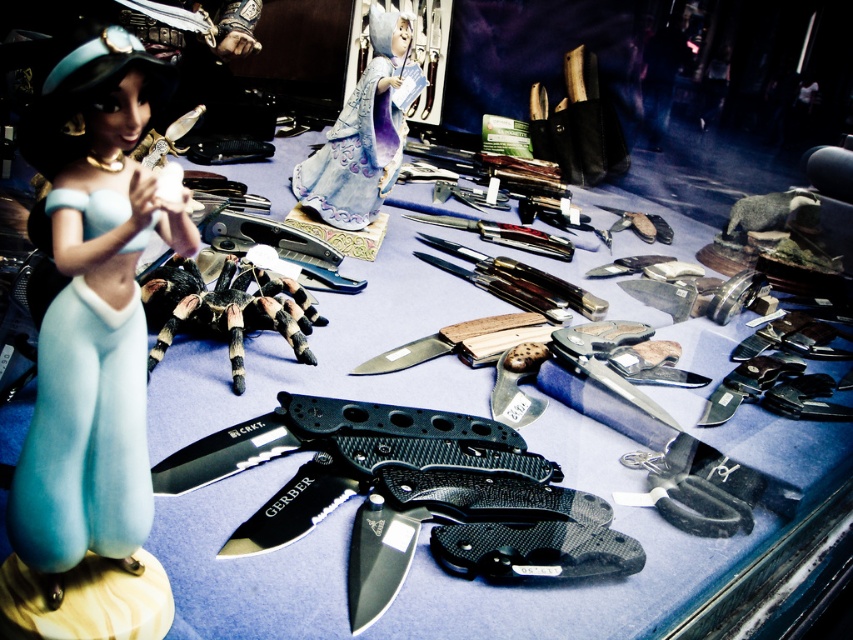
You are a delivery person who needs to place a new 12 inch long package between the matte blue figurine at left and the black hairy tarantula at center. Can you fit the package in the space between them?

The distance between the matte blue figurine at left and the black hairy tarantula at center is 22.81 inches, so yes, the 12 inch package can fit between them since the space is larger than the package length.

You are standing in front of the display case and notice the matte blue figurine at left and the GERBER knife with a black plastic handle. Which object is positioned closer to the left edge of the display case?

The matte blue figurine at left is located at point (93,308), which is closer to the left edge of the display case compared to the GERBER knife with a black plastic handle.

You are a customer in a store looking at the display case. You see the matte blue figurine at left and the porcelain figurine at center. Which one is shorter?

The matte blue figurine at left is shorter than the porcelain figurine at center.